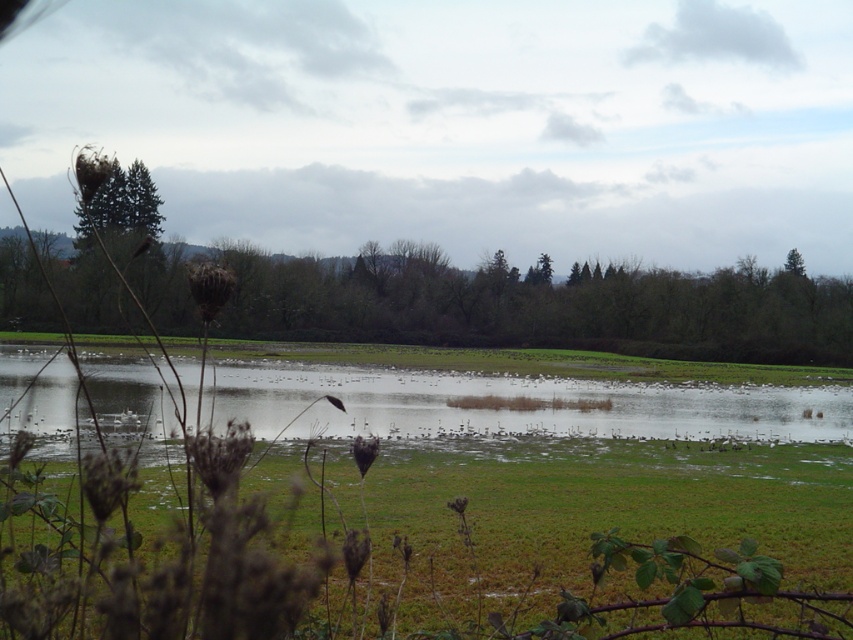
Question: Does green grass at center appear on the right side of green matte tree at upper left?

Choices:
 (A) no
 (B) yes

Answer: (B)

Question: Estimate the real-world distances between objects in this image. Which object is closer to the green grassy lake at center?

Choices:
 (A) green leafy tree at left
 (B) green matte tree at upper left

Answer: (B)

Question: Is green leafy tree at left bigger than green grassy lake at center?

Choices:
 (A) no
 (B) yes

Answer: (B)

Question: Which object appears farthest from the camera in this image?

Choices:
 (A) green grassy lake at center
 (B) green matte tree at upper left
 (C) green grass at center

Answer: (B)

Question: Among these objects, which one is nearest to the camera?

Choices:
 (A) green leafy tree at left
 (B) green grass at center
 (C) green matte tree at upper left

Answer: (B)

Question: Is green leafy tree at left positioned in front of green matte tree at upper left?

Choices:
 (A) no
 (B) yes

Answer: (B)